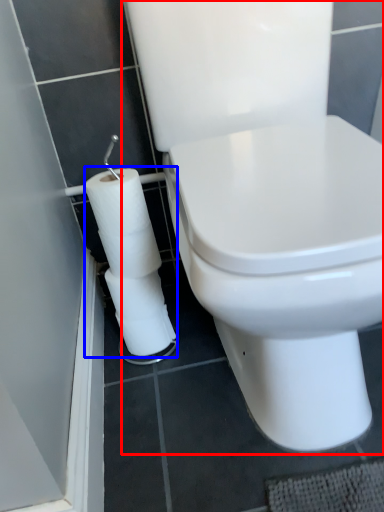
Question: Which object appears closest to the camera in this image, toilet (highlighted by a red box) or toilet paper (highlighted by a blue box)?

Choices:
 (A) toilet
 (B) toilet paper

Answer: (A)